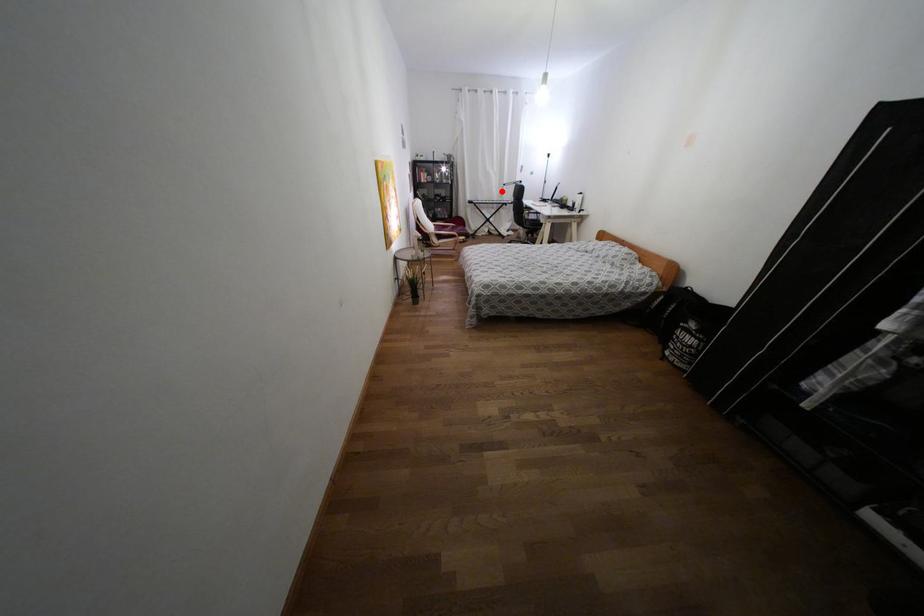
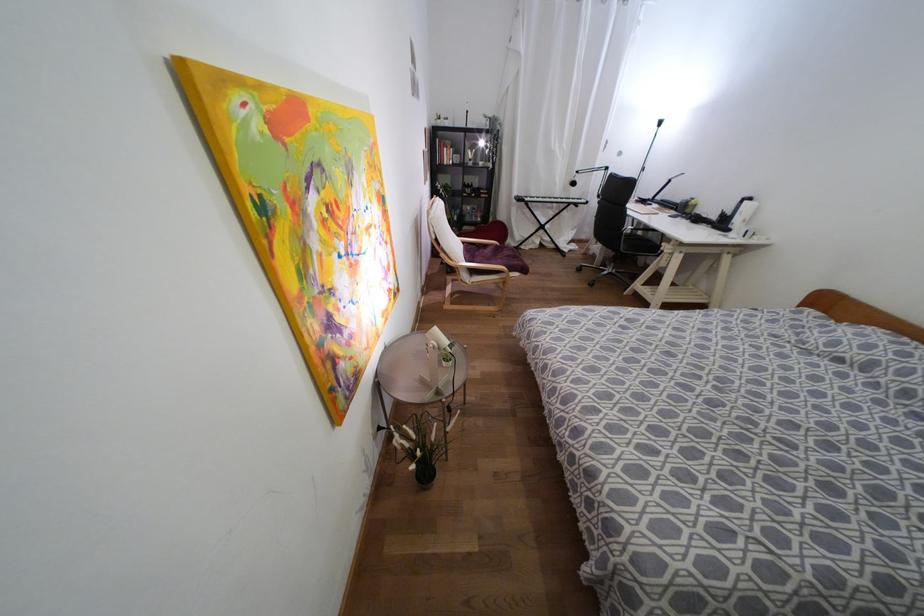
Locate, in the second image, the point that corresponds to the highlighted location in the first image.

(573, 183)